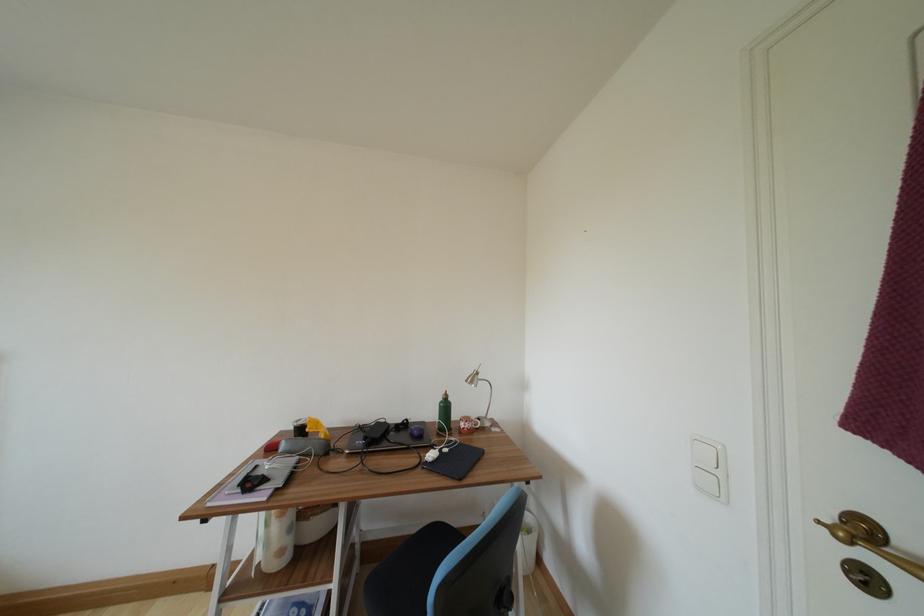
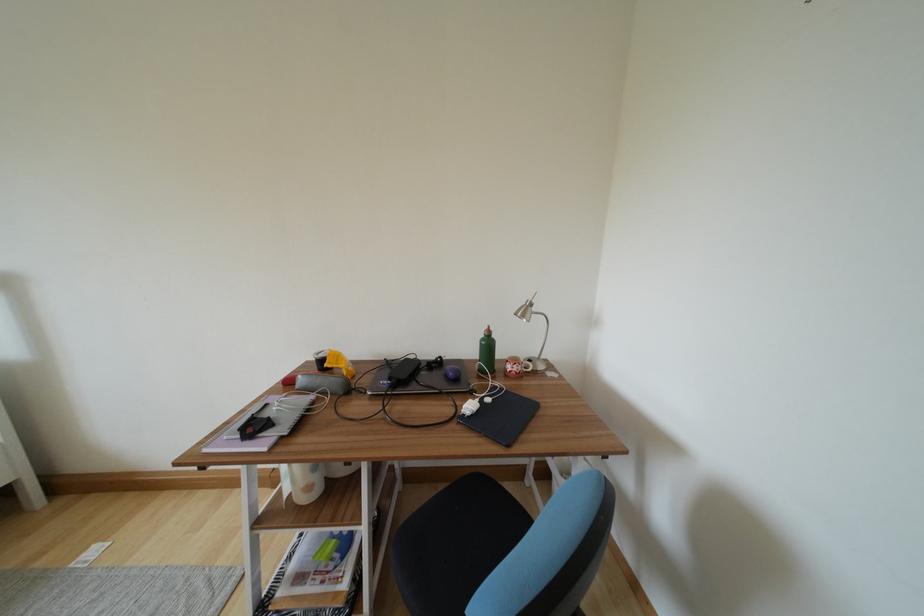
Locate, in the second image, the point that corresponds to pixel 451 411 in the first image.

(493, 349)